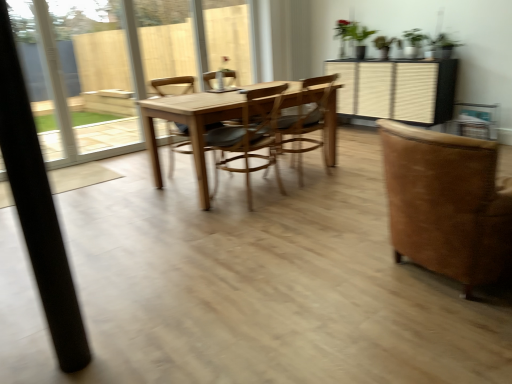
Locate an element on the screen. The width and height of the screenshot is (512, 384). free space in front of wooden chair at center, the 4th chair in the right-to-left sequence is located at coordinates (179, 188).